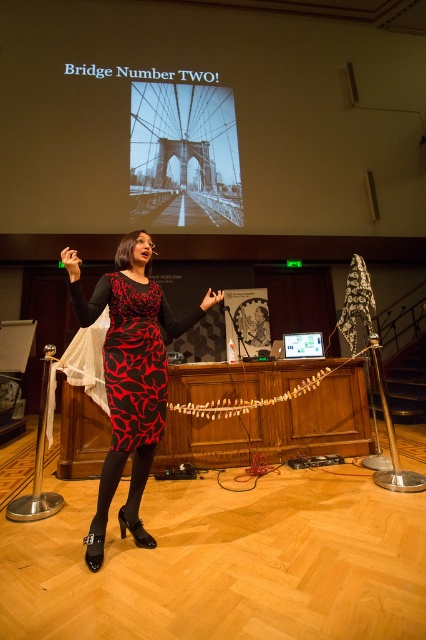
Question: Which object appears farthest from the camera in this image?

Choices:
 (A) black leather high-heeled shoe at lower left
 (B) black glass bridge at upper center
 (C) matte plastic screen at center
 (D) black printed dress at center

Answer: (B)

Question: Among these objects, which one is nearest to the camera?

Choices:
 (A) matte plastic screen at center
 (B) black printed dress at center
 (C) printed fabric dress at center
 (D) black glass bridge at upper center

Answer: (C)

Question: Can you confirm if black glass bridge at upper center is wider than matte plastic screen at center?

Choices:
 (A) yes
 (B) no

Answer: (A)

Question: Observing the image, what is the correct spatial positioning of printed fabric dress at center in reference to matte plastic screen at center?

Choices:
 (A) right
 (B) left

Answer: (B)

Question: Is printed fabric dress at center in front of black leather high-heeled shoe at lower left?

Choices:
 (A) yes
 (B) no

Answer: (A)

Question: Which point is farther from the camera taking this photo?

Choices:
 (A) (296, 356)
 (B) (210, 163)
 (C) (89, 531)

Answer: (B)